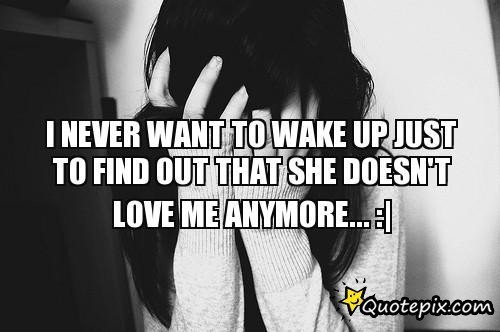
Locate an element on the screen. The height and width of the screenshot is (332, 500). door is located at coordinates (63, 71).